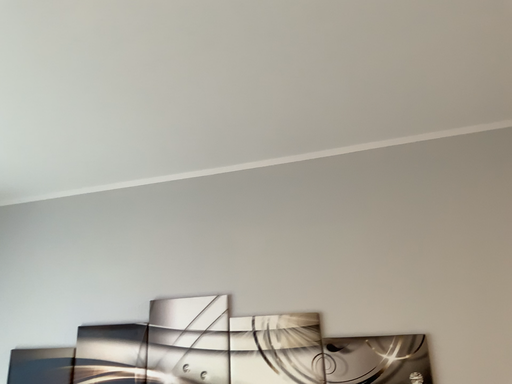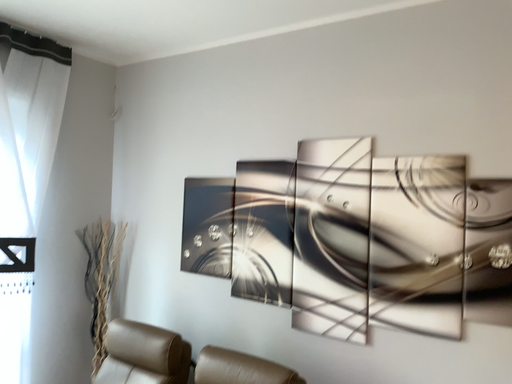
Question: Which way did the camera rotate in the video?

Choices:
 (A) rotated upward
 (B) rotated downward

Answer: (B)